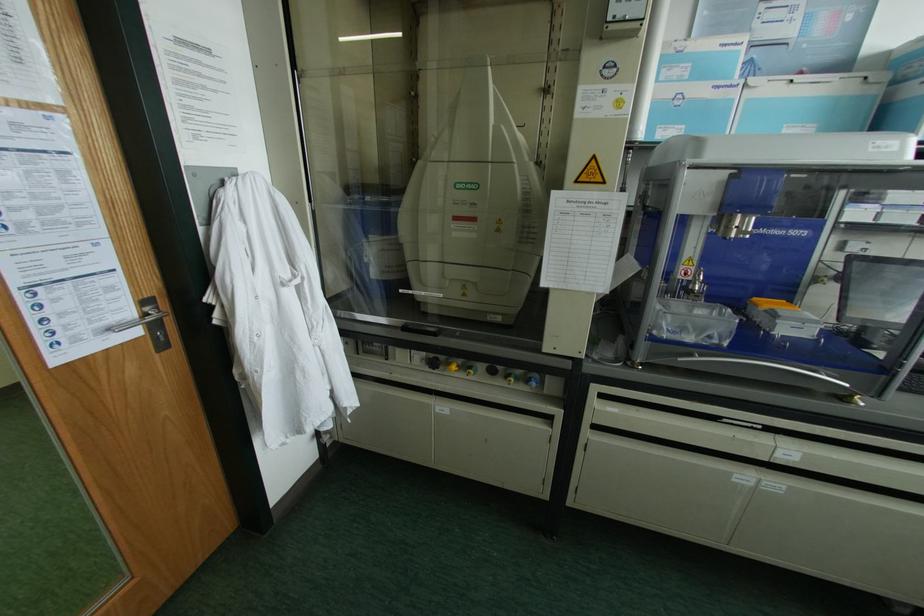
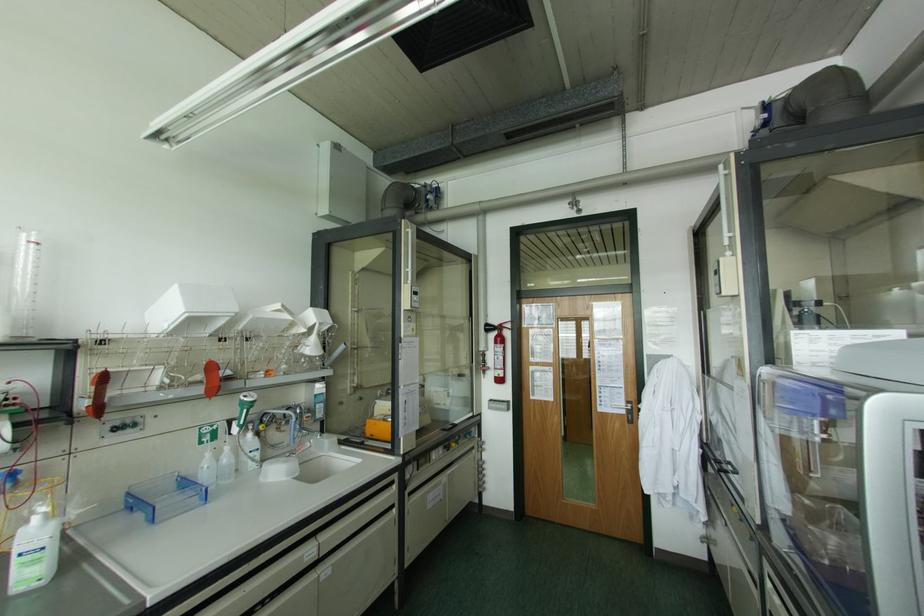
Where in the second image is the point corresponding to point 142,302 from the first image?

(626, 400)